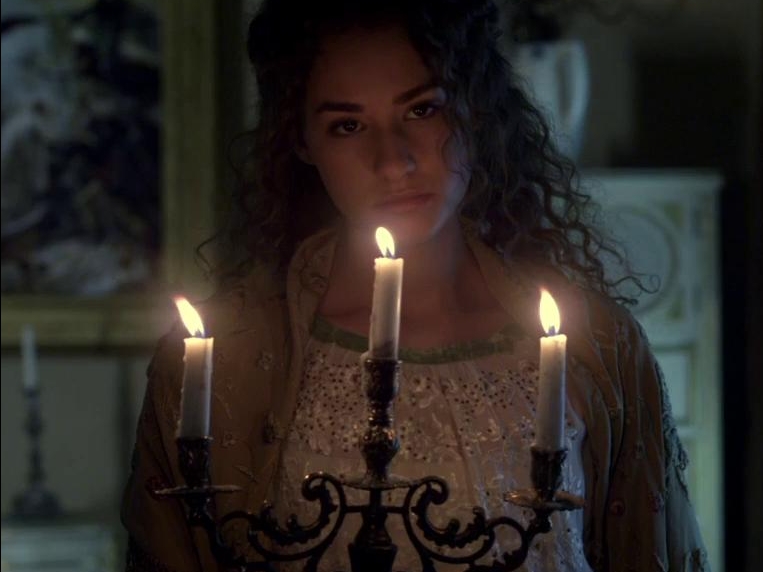
Find the location of `iron`. iron is located at coordinates coord(311,511).